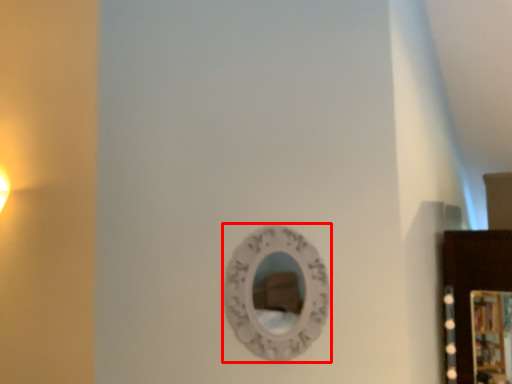
Question: Observing the image, what is the correct spatial positioning of mirror (annotated by the red box) in reference to picture frame?

Choices:
 (A) right
 (B) left

Answer: (B)